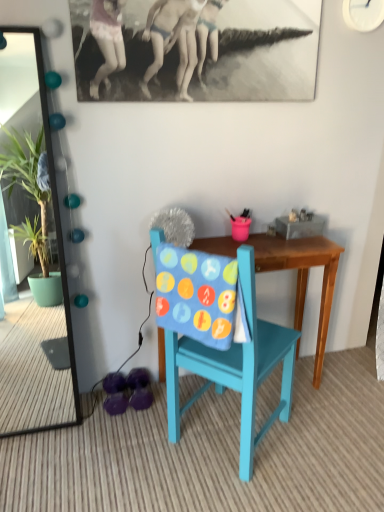
Locate an element on the screen. The width and height of the screenshot is (384, 512). vacant point to the right of purple fabric footwear at lower left is located at coordinates (162, 400).